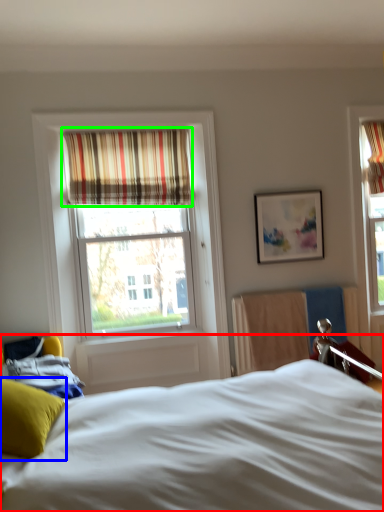
Question: Based on their relative distances, which object is farther from bed (highlighted by a red box)? Choose from pillow (highlighted by a blue box) and curtain (highlighted by a green box).

Choices:
 (A) pillow
 (B) curtain

Answer: (B)